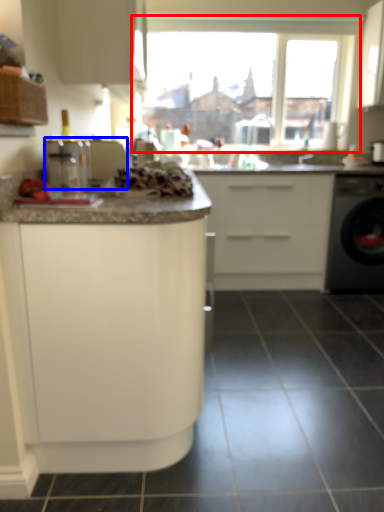
Question: Which object is closer to the camera taking this photo, window (highlighted by a red box) or appliance (highlighted by a blue box)?

Choices:
 (A) window
 (B) appliance

Answer: (B)